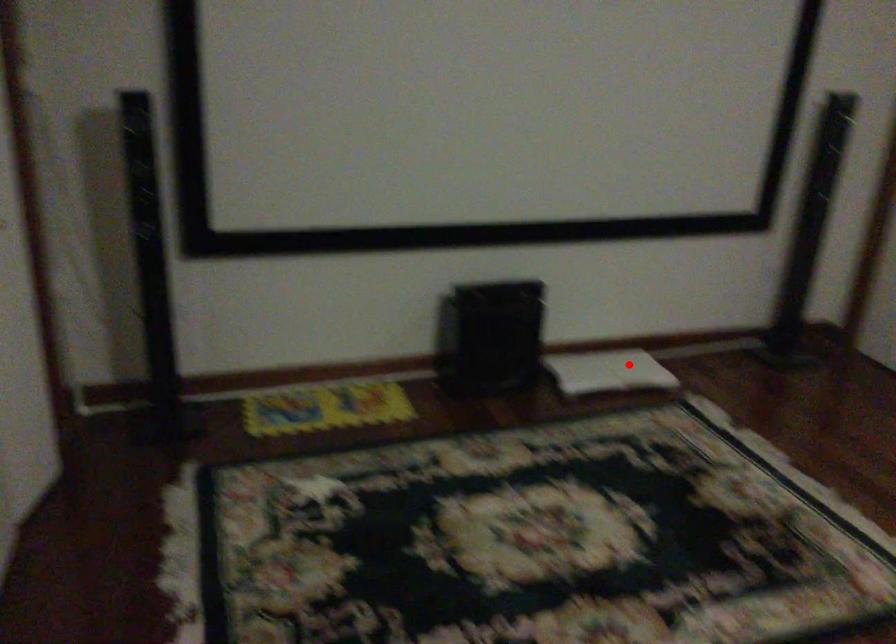
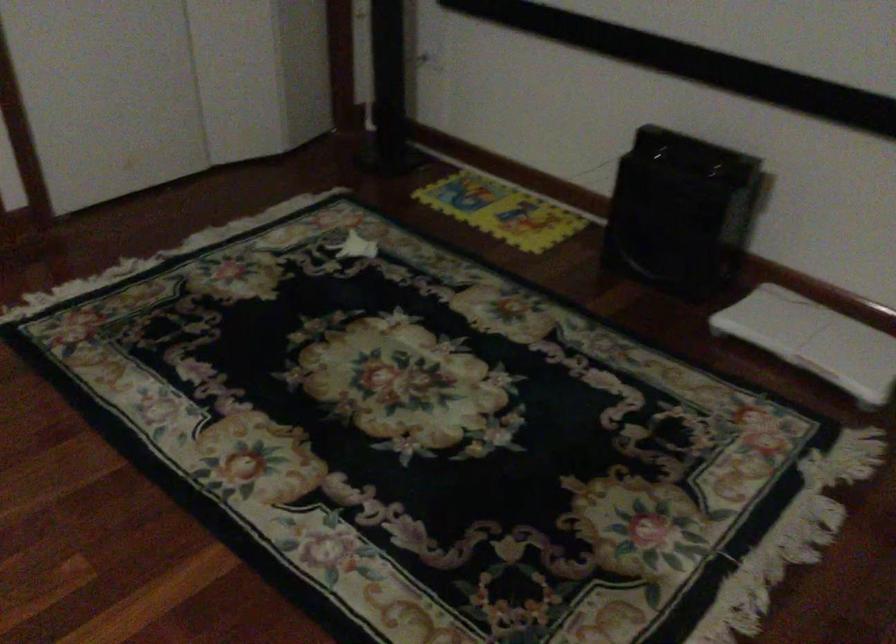
Question: I am providing you with two images of the same scene from different viewpoints. A red point is shown in image1. For the corresponding object point in image2, is it positioned nearer or farther from the camera?

Choices:
 (A) Nearer
 (B) Farther

Answer: (A)